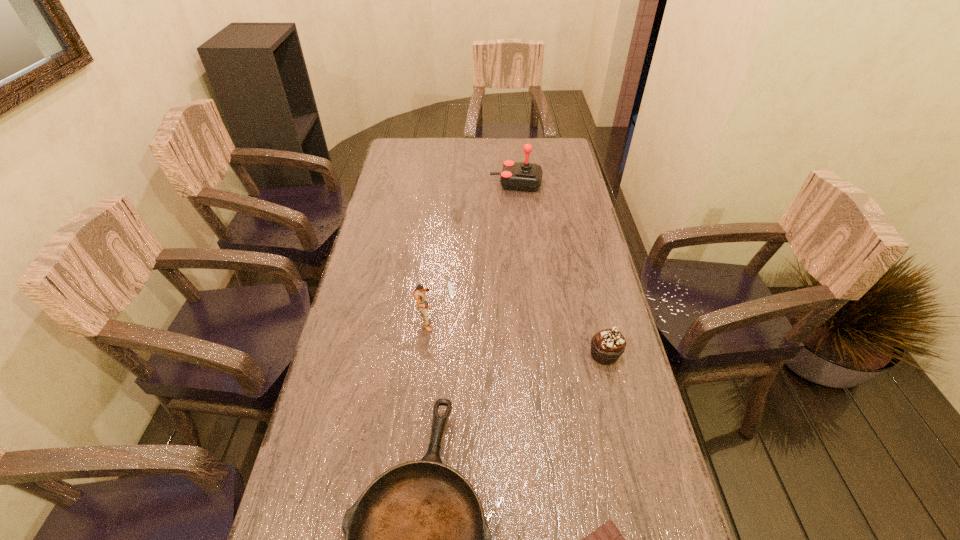
What are the coordinates of `cupcake that is at the right edge` in the screenshot? It's located at (608, 345).

The height and width of the screenshot is (540, 960). I want to click on free space at the far edge of the desktop, so click(x=509, y=138).

This screenshot has width=960, height=540. In the image, there is a desktop. In order to click on vacant space at the left edge in this screenshot , I will do `click(361, 387)`.

You are a GUI agent. You are given a task and a screenshot of the screen. Output one action in this format:
    pyautogui.click(x=<x>, y=<y>)
    Task: Click on the vacant space at the right edge of the desktop
    
    Given the screenshot: What is the action you would take?
    pyautogui.click(x=592, y=283)

You are a GUI agent. You are given a task and a screenshot of the screen. Output one action in this format:
    pyautogui.click(x=<x>, y=<y>)
    Task: Click on the vacant point at the far right corner
    The width and height of the screenshot is (960, 540).
    Given the screenshot: What is the action you would take?
    pyautogui.click(x=551, y=163)

The height and width of the screenshot is (540, 960). In order to click on vacant point located between the third farthest object and the farthest object in this screenshot , I will do `click(561, 269)`.

Find the location of a particular element. free space between the second farthest object and the farthest object is located at coordinates pyautogui.click(x=471, y=251).

Locate an element on the screen. Image resolution: width=960 pixels, height=540 pixels. vacant area that lies between the third farthest object and the farthest object is located at coordinates (561, 269).

Locate an element on the screen. vacant area between the third nearest object and the joystick is located at coordinates pyautogui.click(x=561, y=269).

Image resolution: width=960 pixels, height=540 pixels. Find the location of `object that can be found as the second closest to the third shortest object`. object that can be found as the second closest to the third shortest object is located at coordinates (607, 539).